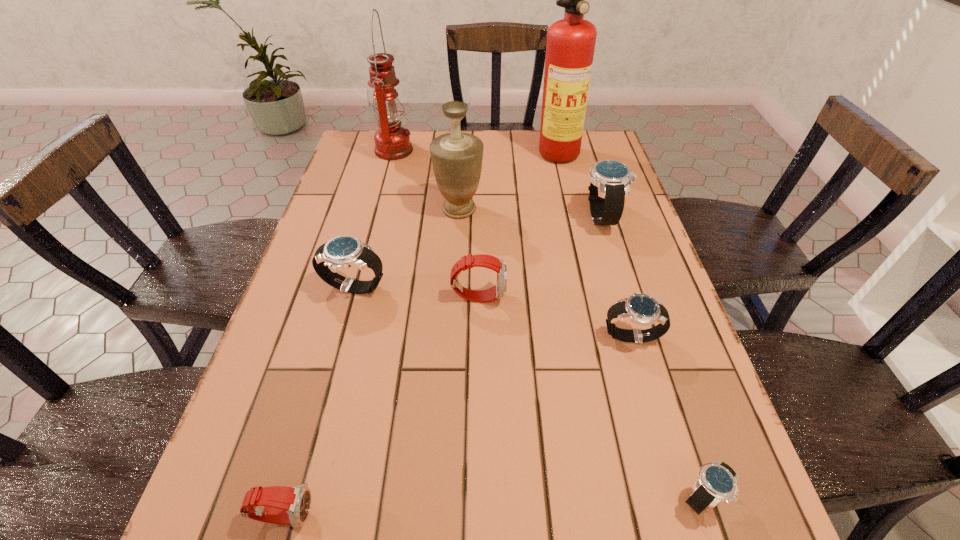
Find the location of a particular element. watch that is the fifth closest to the farthest silver watch is located at coordinates (284, 505).

Find the location of a particular element. The height and width of the screenshot is (540, 960). watch that stands as the third closest to the red oil lamp is located at coordinates [498, 291].

This screenshot has width=960, height=540. I want to click on silver watch that can be found as the third closest to the red oil lamp, so (x=642, y=309).

Identify the location of the third closest silver watch to the biggest silver watch. (717, 481).

Locate an element on the screen. This screenshot has height=540, width=960. free space that satisfies the following two spatial constraints: 1. on the front-facing side of the tallest watch; 2. on the left side of the fire extinguisher is located at coordinates (582, 217).

Locate an element on the screen. free spot that satisfies the following two spatial constraints: 1. on the front side of the shortest watch; 2. on the right side of the leftmost silver watch is located at coordinates (298, 497).

The image size is (960, 540). What are the coordinates of `blank area in the image that satisfies the following two spatial constraints: 1. on the back side of the third nearest object; 2. on the face of the bigger red watch` in the screenshot? It's located at (619, 296).

At what (x,y) coordinates should I click in order to perform the action: click on free space that satisfies the following two spatial constraints: 1. on the front-facing side of the fire extinguisher; 2. on the left side of the seventh farthest object. Please return your answer as a coordinate pair (x, y). The width and height of the screenshot is (960, 540). Looking at the image, I should click on (612, 335).